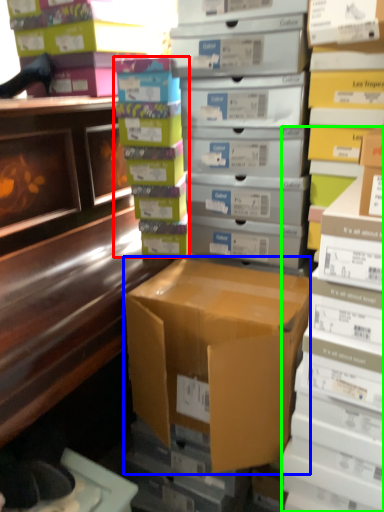
Question: Based on their relative distances, which object is nearer to book (highlighted by a red box)? Choose from box (highlighted by a blue box) and book (highlighted by a green box).

Choices:
 (A) box
 (B) book

Answer: (A)